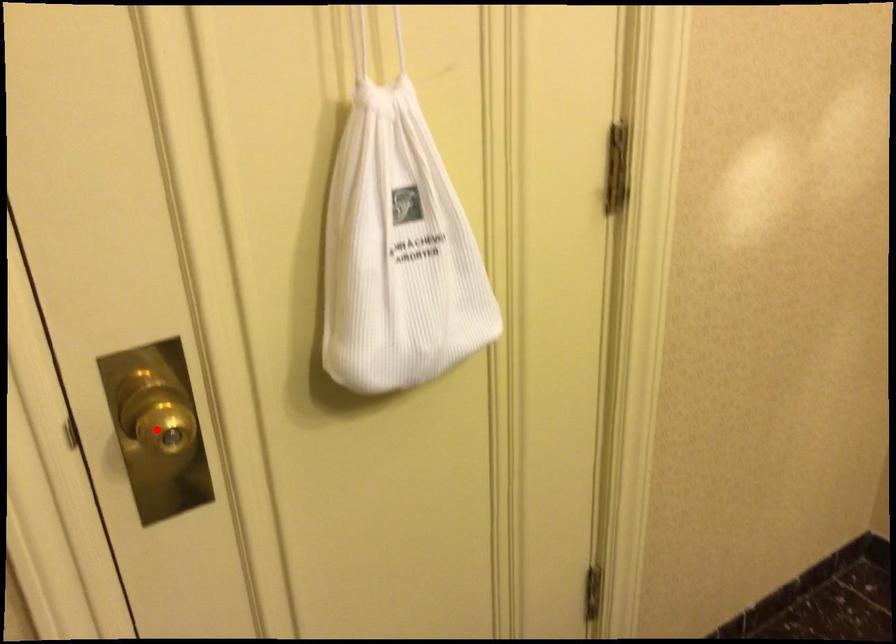
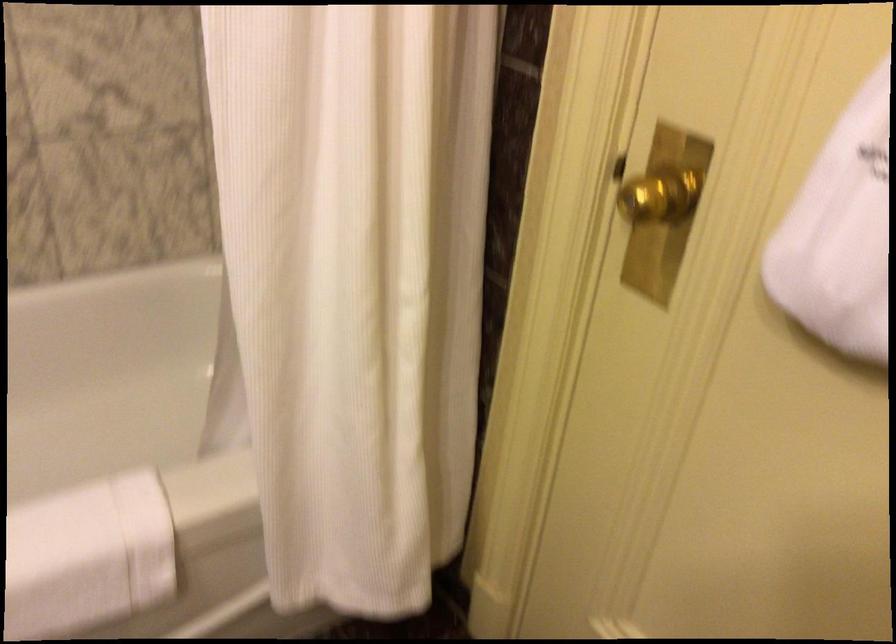
Locate, in the second image, the point that corresponds to the highlighted location in the first image.

(657, 194)